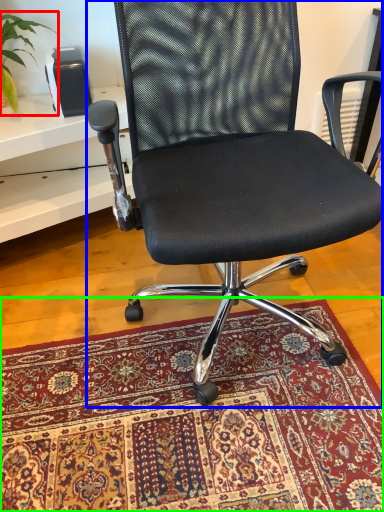
Question: Which is farther away from plant (highlighted by a red box)? chair (highlighted by a blue box) or mat (highlighted by a green box)?

Choices:
 (A) chair
 (B) mat

Answer: (B)